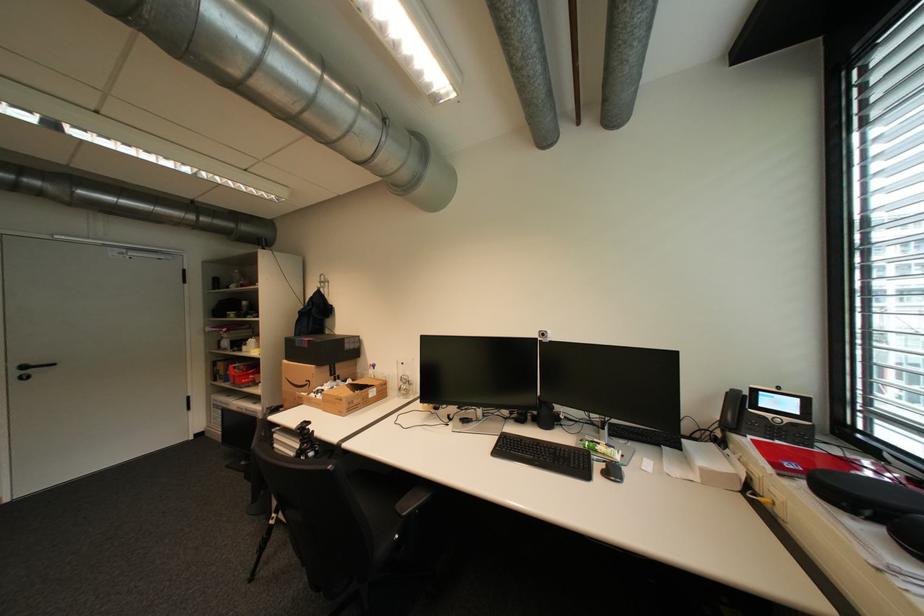
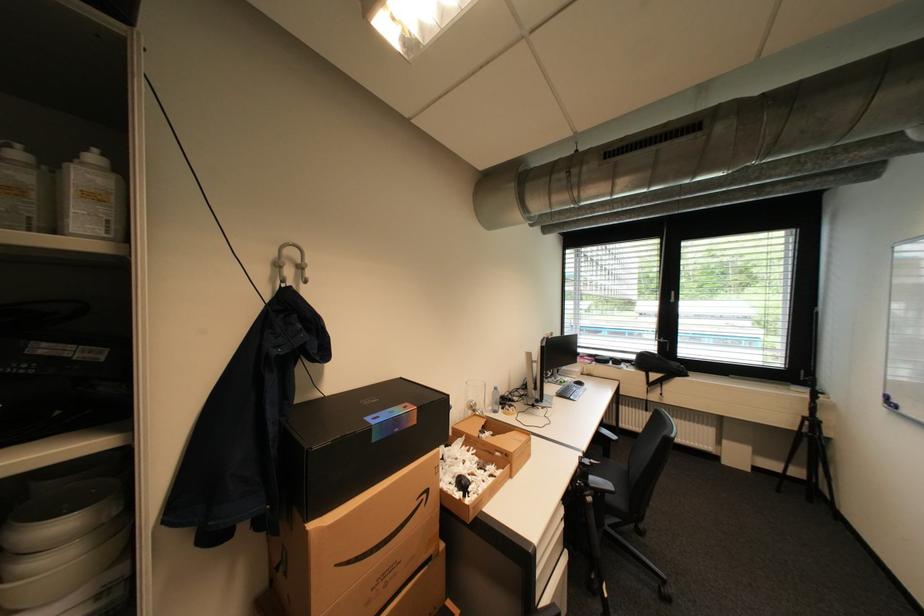
The point at (x=317, y=383) is marked in the first image. Where is the corresponding point in the second image?

(433, 496)